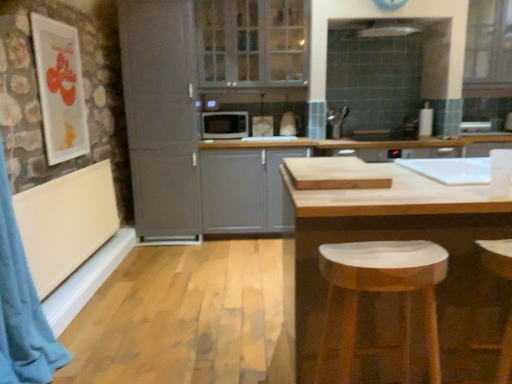
The height and width of the screenshot is (384, 512). I want to click on free space above matte white picture frame at upper left (from a real-world perspective), so click(x=51, y=19).